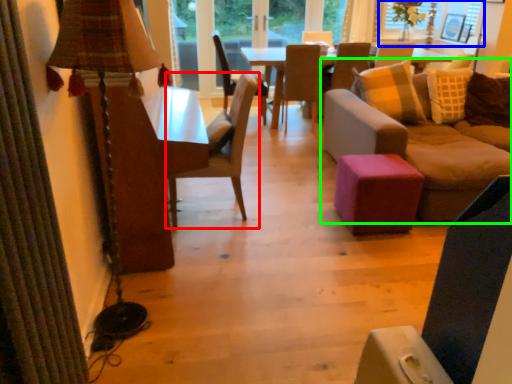
Question: Which object is positioned closest to chair (highlighted by a red box)? Select from window screen (highlighted by a blue box) and studio couch (highlighted by a green box).

Choices:
 (A) window screen
 (B) studio couch

Answer: (B)